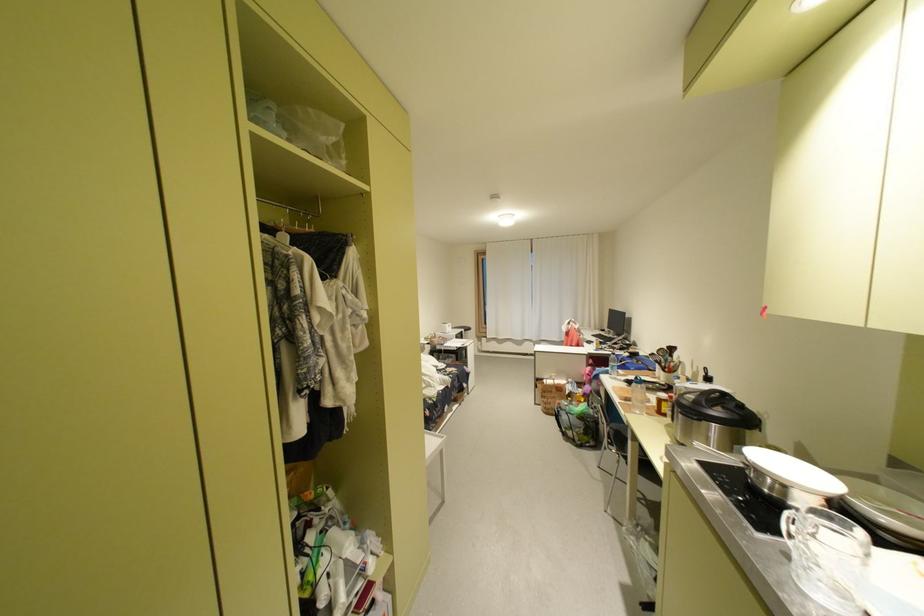
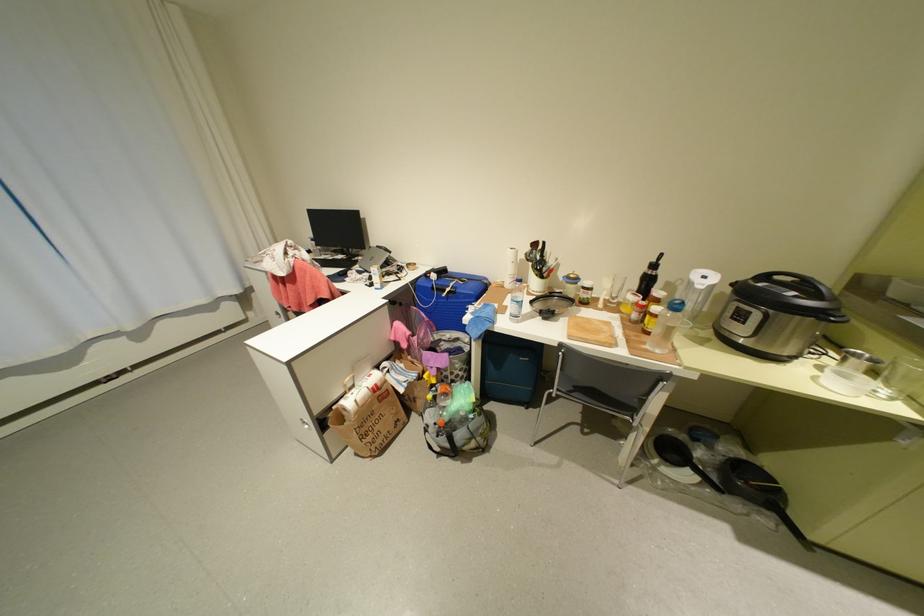
Locate, in the second image, the point that corresponds to point (638, 355) in the first image.

(444, 276)